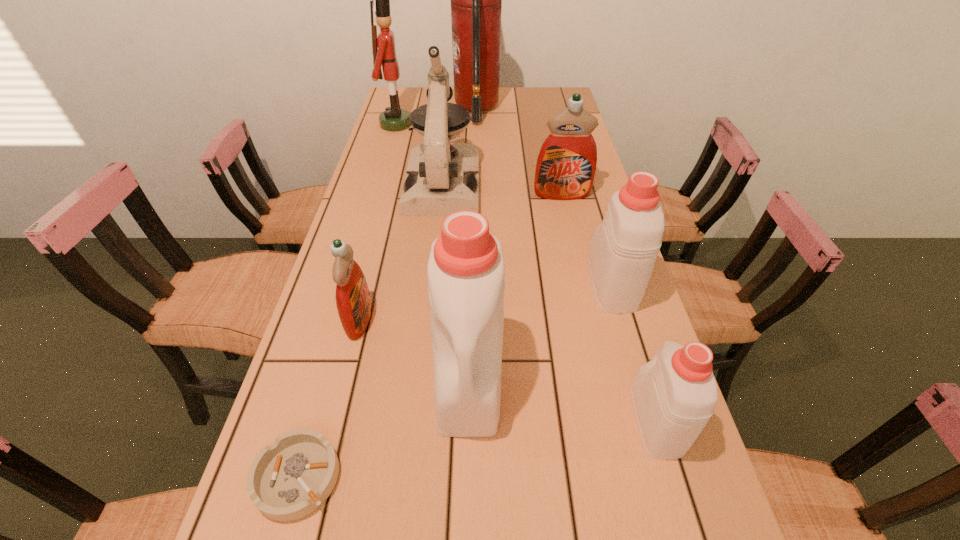
Locate an element on the screen. The image size is (960, 540). fire extinguisher is located at coordinates (476, 0).

At what (x,y) coordinates should I click in order to perform the action: click on nutcracker. Please return your answer as a coordinate pair (x, y). Image resolution: width=960 pixels, height=540 pixels. Looking at the image, I should click on (394, 118).

The width and height of the screenshot is (960, 540). What are the coordinates of `microscope` in the screenshot? It's located at (441, 178).

The width and height of the screenshot is (960, 540). I want to click on the leftmost white detergent, so click(465, 271).

The image size is (960, 540). In order to click on the biggest white detergent in this screenshot , I will do `click(465, 271)`.

Locate an element on the screen. The height and width of the screenshot is (540, 960). the second smallest white detergent is located at coordinates (622, 254).

Where is `the bigger red detergent`? Image resolution: width=960 pixels, height=540 pixels. the bigger red detergent is located at coordinates (566, 165).

What are the coordinates of `the farthest detergent` in the screenshot? It's located at (566, 165).

I want to click on the smallest white detergent, so click(x=674, y=395).

Find the location of a particular element. The image size is (960, 540). the left red detergent is located at coordinates (353, 301).